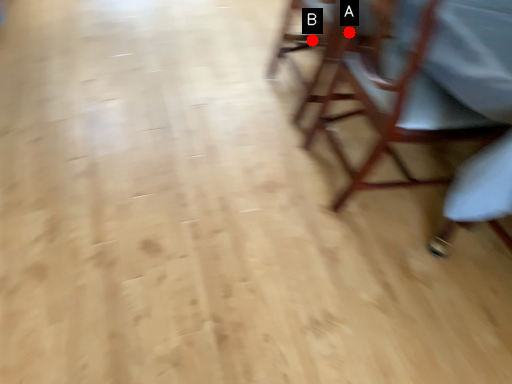
Question: Two points are circled on the image, labeled by A and B beside each circle. Which point is farther from the camera taking this photo?

Choices:
 (A) A is further
 (B) B is further

Answer: (B)